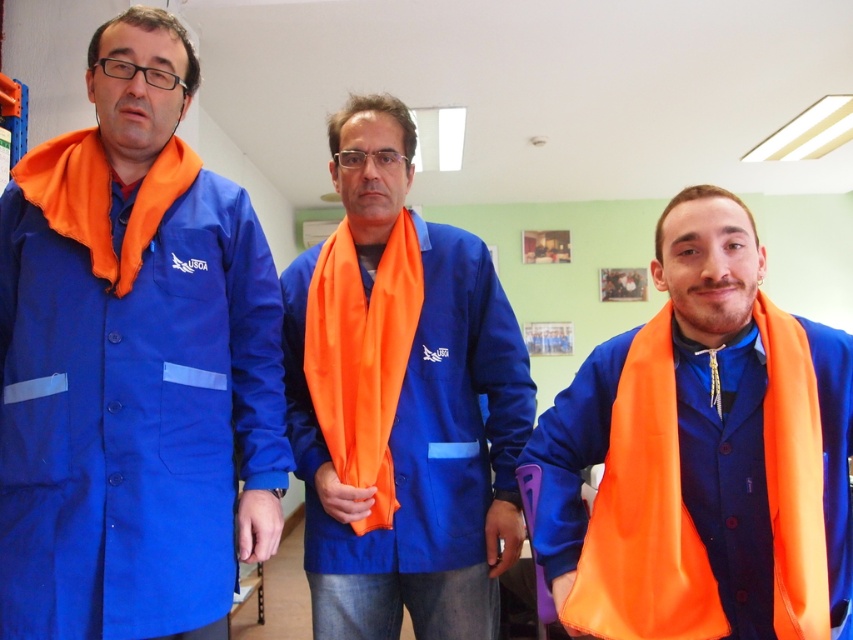
Does orange fabric scarf at right have a lesser width compared to orange satin scarf at center?

No, orange fabric scarf at right is not thinner than orange satin scarf at center.

Is point (695, 570) in front of point (344, 280)?

Yes, point (695, 570) is in front of point (344, 280).

Image resolution: width=853 pixels, height=640 pixels. What do you see at coordinates (703, 452) in the screenshot?
I see `orange fabric scarf at right` at bounding box center [703, 452].

In order to click on orange fabric scarf at right in this screenshot , I will do `click(703, 452)`.

Does matte blue coat at left lie behind orange fabric scarf at right?

Yes, matte blue coat at left is behind orange fabric scarf at right.

What do you see at coordinates (132, 364) in the screenshot?
I see `matte blue coat at left` at bounding box center [132, 364].

Which is behind, point (202, 353) or point (732, 355)?

Point (202, 353)

Where is `matte blue coat at left`? matte blue coat at left is located at coordinates (132, 364).

Which is more to the left, matte blue jacket at center or orange satin scarf at center?

orange satin scarf at center is more to the left.

From the picture: Does matte blue jacket at center have a smaller size compared to orange satin scarf at center?

No, matte blue jacket at center is not smaller than orange satin scarf at center.

Identify the location of matte blue jacket at center. The height and width of the screenshot is (640, 853). (399, 403).